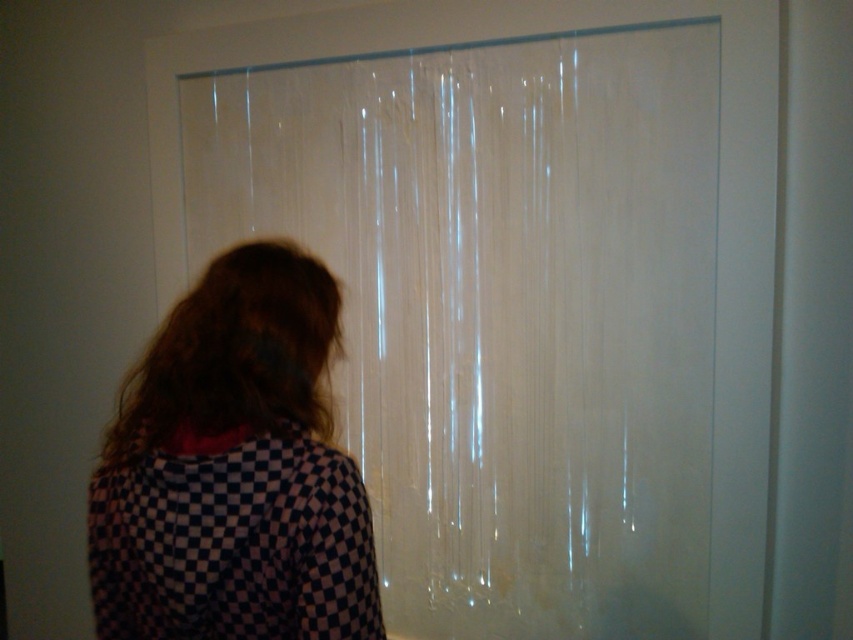
You are trying to decide whether to use the transparent plastic shower curtain at center or the checkered fabric at left to cover a rectangular opening. Which one would you choose if you need the material to completely cover the opening without any gaps?

The transparent plastic shower curtain at center might be wider than checkered fabric at left, so it is more likely to cover the opening without gaps.

You are a photographer setting up a shoot in the described scene. You need to ensure that the transparent plastic shower curtain at center does not block the view of the brownhair at left in your photo. Can you position yourself in a way that allows both objects to be visible without one obscuring the other?

The transparent plastic shower curtain at center is bigger than brownhair at left, so positioning yourself at an angle where the smaller brownhair at left is not directly behind the larger curtain would allow both to be visible without obstruction.

You are a photographer setting up a shot in this scene. You need to place a small light source between the two points marked as point (259, 88) and point (86, 541). Based on their positions, which point should the light be closer to in order to ensure it illuminates the area near the camera more effectively?

The light should be placed closer to point (259, 88) because it is closer to the camera than point (86, 541), so positioning the light near it would better illuminate the area near the camera.